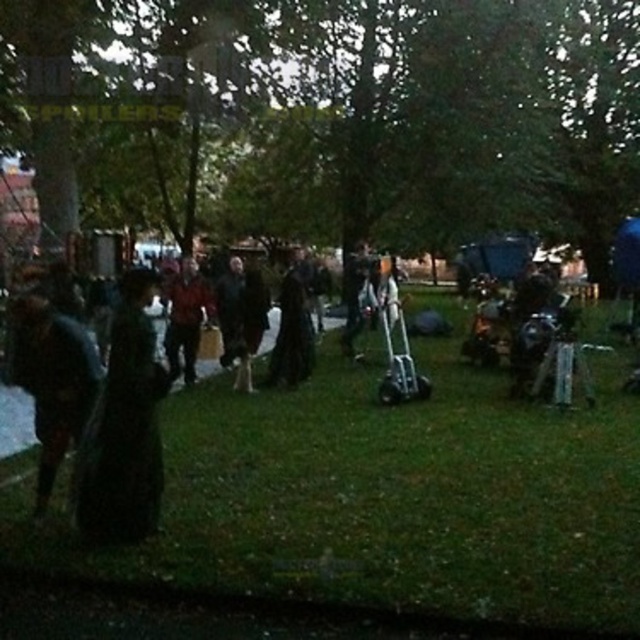
Question: Is green grass at center thinner than dark matte robe at center?

Choices:
 (A) no
 (B) yes

Answer: (A)

Question: Is dark brown leather jacket at left to the right of dark matte robe at center from the viewer's perspective?

Choices:
 (A) no
 (B) yes

Answer: (A)

Question: Which of the following is the farthest from the observer?

Choices:
 (A) dark fabric coat at center
 (B) dark matte robe at center
 (C) red fabric jacket at center
 (D) dark green fabric dress at center

Answer: (B)

Question: Which point is closer to the camera?

Choices:
 (A) green grass at center
 (B) dark matte robe at center
 (C) dark fabric coat at center
 (D) red fabric jacket at center

Answer: (A)

Question: Does dark brown leather jacket at left appear under dark fabric coat at center?

Choices:
 (A) yes
 (B) no

Answer: (A)

Question: Which point is farther to the camera?

Choices:
 (A) dark fabric coat at center
 (B) dark green fabric dress at center

Answer: (A)